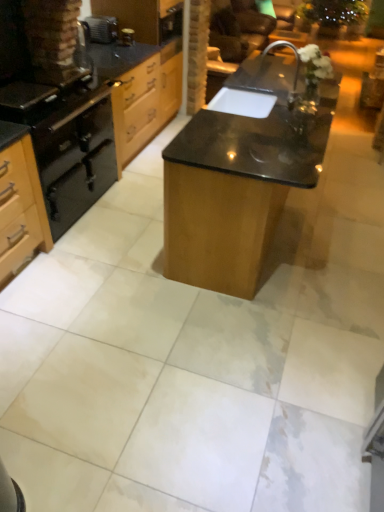
The height and width of the screenshot is (512, 384). What do you see at coordinates (20, 200) in the screenshot?
I see `matte black oven at left` at bounding box center [20, 200].

The image size is (384, 512). Describe the element at coordinates (127, 36) in the screenshot. I see `metallic canister at upper center, positioned as the second appliance in left-to-right order` at that location.

This screenshot has height=512, width=384. Find the location of `metallic canister at upper center, positioned as the second appliance in left-to-right order`. metallic canister at upper center, positioned as the second appliance in left-to-right order is located at coordinates (127, 36).

Locate an element on the screen. brown leather armchair at upper center is located at coordinates (238, 28).

Find the location of a particular element. brushed metal toaster at upper left, the 2th appliance in the right-to-left sequence is located at coordinates (101, 29).

Which object is positioned more to the right, black matte gas stove at left or black matte oven at left?

From the viewer's perspective, black matte gas stove at left appears more on the right side.

Considering the positions of point (59, 101) and point (48, 154), is point (59, 101) closer or farther from the camera than point (48, 154)?

Point (59, 101) appears to be farther away from the viewer than point (48, 154).

Based on the photo, is black matte gas stove at left in front of black matte oven at left?

Yes, black matte gas stove at left is closer to the viewer.

From the image's perspective, is black matte gas stove at left under black matte oven at left?

Actually, black matte gas stove at left appears above black matte oven at left in the image.

Locate an element on the screen. The height and width of the screenshot is (512, 384). oven located behind the matte black oven at left is located at coordinates (76, 164).

From the image's perspective, which one is positioned lower, black matte oven at left or matte black oven at left?

matte black oven at left appears lower in the image.

From a real-world perspective, is black matte oven at left above or below matte black oven at left?

black matte oven at left is below matte black oven at left.

From the image's perspective, is wooden drawer at upper left on black matte oven at left?

Yes.

In the image, is wooden drawer at upper left on the left side or the right side of black matte oven at left?

wooden drawer at upper left is to the right of black matte oven at left.

From the picture: Which object is closer to the camera taking this photo, wooden drawer at upper left or black matte oven at left?

black matte oven at left is more forward.

From a real-world perspective, between wooden drawer at upper left and black matte oven at left, who is vertically higher?

From a 3D spatial view, wooden drawer at upper left is above.

Can you see wooden drawer at upper left touching black matte gas stove at left?

No, wooden drawer at upper left is not making contact with black matte gas stove at left.

Is black matte gas stove at left completely or partially inside wooden drawer at upper left?

No, black matte gas stove at left is located outside of wooden drawer at upper left.

Considering the relative sizes of wooden drawer at upper left and black matte gas stove at left in the image provided, is wooden drawer at upper left wider than black matte gas stove at left?

Incorrect, the width of wooden drawer at upper left does not surpass that of black matte gas stove at left.

How many degrees apart are the facing directions of wooden drawer at upper left and black matte gas stove at left?

There is a 0.000454-degree angle between the facing directions of wooden drawer at upper left and black matte gas stove at left.

I want to click on oven below the wooden drawer at upper left (from a real-world perspective), so click(76, 164).

Consider the image. Are black matte oven at left and wooden drawer at upper left far apart?

They are positioned close to each other.

Consider the image. Does black matte oven at left have a lesser height compared to wooden drawer at upper left?

Indeed, black matte oven at left has a lesser height compared to wooden drawer at upper left.

Is brushed metal toaster at upper left, the first appliance from the left, aimed at metallic canister at upper center, the first appliance from the right?

Yes, brushed metal toaster at upper left, the first appliance from the left, is oriented towards metallic canister at upper center, the first appliance from the right.

Does brushed metal toaster at upper left, the first appliance from the left, touch metallic canister at upper center, the first appliance from the right?

No, brushed metal toaster at upper left, the first appliance from the left, is not with metallic canister at upper center, the first appliance from the right.

From a real-world perspective, is brushed metal toaster at upper left, the 2th appliance in the right-to-left sequence, positioned over metallic canister at upper center, the first appliance from the right, based on gravity?

Correct, in the physical world, brushed metal toaster at upper left, the 2th appliance in the right-to-left sequence, is higher than metallic canister at upper center, the first appliance from the right.

From the image's perspective, who appears lower, brushed metal toaster at upper left, the 2th appliance in the right-to-left sequence, or metallic canister at upper center, positioned as the second appliance in left-to-right order?

From the image's view, metallic canister at upper center, positioned as the second appliance in left-to-right order, is below.

Does brushed metal toaster at upper left, the 2th appliance in the right-to-left sequence, lie behind brown leather armchair at upper center?

No, brushed metal toaster at upper left, the 2th appliance in the right-to-left sequence, is closer to the viewer.

Considering the sizes of objects brushed metal toaster at upper left, the 2th appliance in the right-to-left sequence, and brown leather armchair at upper center in the image provided, who is taller, brushed metal toaster at upper left, the 2th appliance in the right-to-left sequence, or brown leather armchair at upper center?

Standing taller between the two is brown leather armchair at upper center.

How far apart are brushed metal toaster at upper left, the first appliance from the left, and brown leather armchair at upper center?

They are 2.36 meters apart.

Is brushed metal toaster at upper left, the 2th appliance in the right-to-left sequence, placed right next to brown leather armchair at upper center?

No, brushed metal toaster at upper left, the 2th appliance in the right-to-left sequence, is not with brown leather armchair at upper center.

Image resolution: width=384 pixels, height=512 pixels. What are the coordinates of `oven behind the black matte gas stove at left` in the screenshot? It's located at (76, 164).

You are a GUI agent. You are given a task and a screenshot of the screen. Output one action in this format:
    pyautogui.click(x=<x>, y=<y>)
    Task: Click on the cabinetry located above the black matte oven at left (from a real-world perspective)
    Image resolution: width=384 pixels, height=512 pixels.
    Given the screenshot: What is the action you would take?
    [x=20, y=200]

Estimate the real-world distances between objects in this image. Which object is further from brushed metal toaster at upper left, the 2th appliance in the right-to-left sequence, metallic canister at upper center, positioned as the second appliance in left-to-right order, or black matte gas stove at left?

The object further to brushed metal toaster at upper left, the 2th appliance in the right-to-left sequence, is black matte gas stove at left.

When comparing their distances from black matte gas stove at left, does metallic canister at upper center, the first appliance from the right, or brushed metal toaster at upper left, the 2th appliance in the right-to-left sequence, seem further?

metallic canister at upper center, the first appliance from the right.

Based on their spatial positions, is brushed metal toaster at upper left, the first appliance from the left, or matte black oven at left closer to metallic canister at upper center, positioned as the second appliance in left-to-right order?

The object closer to metallic canister at upper center, positioned as the second appliance in left-to-right order, is brushed metal toaster at upper left, the first appliance from the left.

Based on their spatial positions, is metallic canister at upper center, the first appliance from the right, or brown leather armchair at upper center closer to brushed metal toaster at upper left, the 2th appliance in the right-to-left sequence?

metallic canister at upper center, the first appliance from the right, is closer to brushed metal toaster at upper left, the 2th appliance in the right-to-left sequence.

Based on their spatial positions, is wooden drawer at upper left or brown leather armchair at upper center further from black matte oven at left?

brown leather armchair at upper center.

Considering their positions, is brown leather armchair at upper center positioned closer to black matte gas stove at left than brushed metal toaster at upper left, the first appliance from the left?

The object closer to black matte gas stove at left is brushed metal toaster at upper left, the first appliance from the left.

Which object lies further to the anchor point black matte oven at left, matte black oven at left or black matte gas stove at left?

matte black oven at left is positioned further to the anchor black matte oven at left.

When comparing their distances from wooden drawer at upper left, does brown leather armchair at upper center or matte black oven at left seem further?

brown leather armchair at upper center.

This screenshot has height=512, width=384. I want to click on oven between black matte gas stove at left and wooden drawer at upper left in the front-back direction, so click(x=76, y=164).

The width and height of the screenshot is (384, 512). What are the coordinates of `gas stove between matte black oven at left and brown leather armchair at upper center along the z-axis` in the screenshot? It's located at (53, 98).

Locate an element on the screen. file cabinet located between matte black oven at left and brushed metal toaster at upper left, the 2th appliance in the right-to-left sequence, in the depth direction is located at coordinates (146, 71).

Locate an element on the screen. oven between wooden drawer at upper left and matte black oven at left from top to bottom is located at coordinates (76, 164).